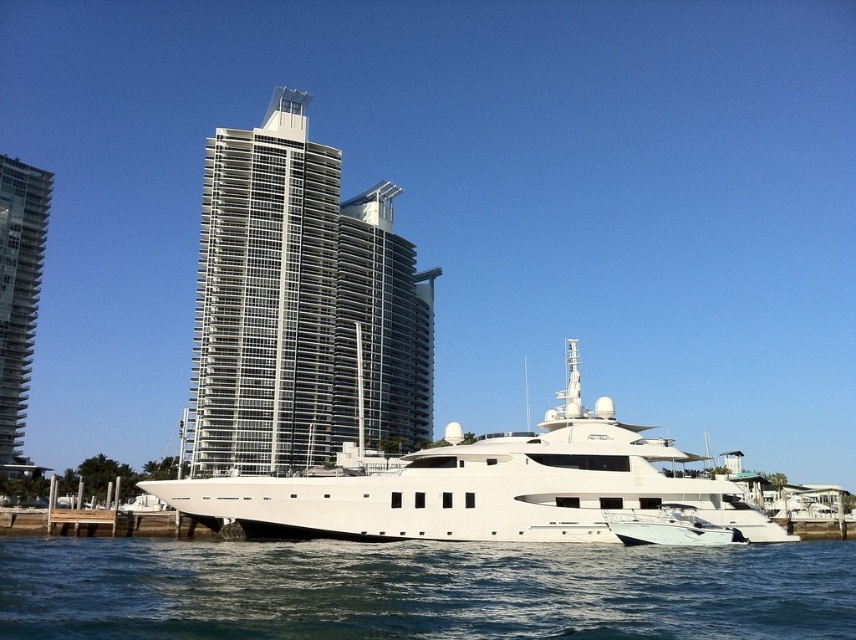
Question: Which of the following is the closest to the observer?

Choices:
 (A) silver glass skyscraper at center
 (B) clear blue water at lower center

Answer: (B)

Question: Observing the image, what is the correct spatial positioning of clear blue water at lower center in reference to glassy steel skyscraper at left?

Choices:
 (A) left
 (B) right

Answer: (B)

Question: Which point is closer to the camera?

Choices:
 (A) pos(321,320)
 (B) pos(831,563)
 (C) pos(28,224)

Answer: (B)

Question: Does white glossy yacht at center lie in front of glassy steel skyscraper at left?

Choices:
 (A) no
 (B) yes

Answer: (B)

Question: Among these points, which one is nearest to the camera?

Choices:
 (A) (278, 486)
 (B) (229, 150)
 (C) (15, 380)
 (D) (646, 529)

Answer: (D)

Question: Can you confirm if white glossy yacht at center is thinner than white glossy motorboat at lower right?

Choices:
 (A) no
 (B) yes

Answer: (A)